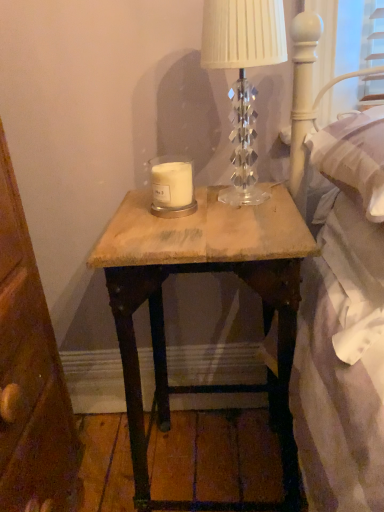
Question: Is wooden nightstand at center bigger or smaller than white matte candle at center?

Choices:
 (A) small
 (B) big

Answer: (B)

Question: Considering the relative positions of wooden nightstand at center and white matte candle at center in the image provided, is wooden nightstand at center to the left or to the right of white matte candle at center?

Choices:
 (A) right
 (B) left

Answer: (A)

Question: Which of these objects is positioned closest to the white matte candle at center?

Choices:
 (A) clear crystal lamp at upper center
 (B) wooden nightstand at center

Answer: (A)

Question: Estimate the real-world distances between objects in this image. Which object is farther from the wooden nightstand at center?

Choices:
 (A) clear crystal lamp at upper center
 (B) white matte candle at center

Answer: (B)